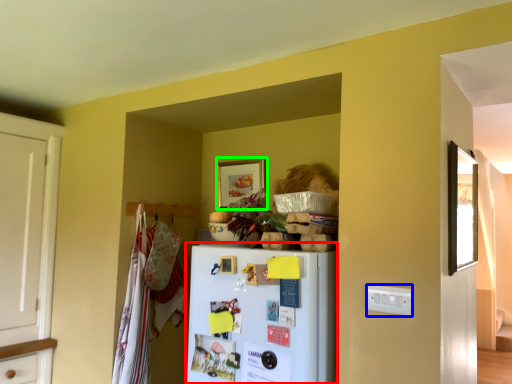
Question: Estimate the real-world distances between objects in this image. Which object is closer to refrigerator (highlighted by a red box), electric outlet (highlighted by a blue box) or picture frame (highlighted by a green box)?

Choices:
 (A) electric outlet
 (B) picture frame

Answer: (A)